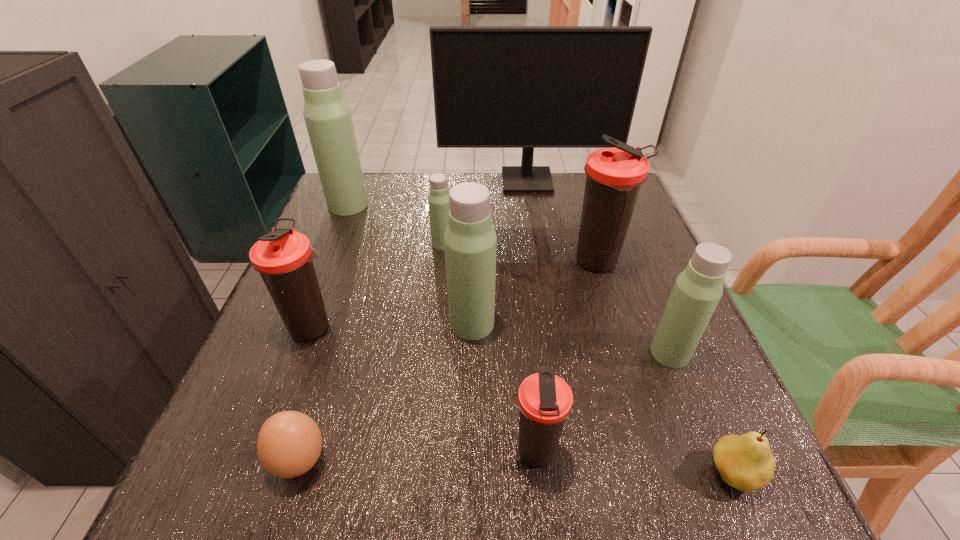
This screenshot has width=960, height=540. What are the coordinates of `boiled egg that is at the near edge` in the screenshot? It's located at (289, 443).

Where is `boiled egg that is at the left edge`? Image resolution: width=960 pixels, height=540 pixels. boiled egg that is at the left edge is located at coordinates (289, 443).

In order to click on computer monitor positioned at the right edge in this screenshot , I will do `click(527, 87)`.

This screenshot has width=960, height=540. What are the coordinates of `pear that is at the right edge` in the screenshot? It's located at (745, 462).

The width and height of the screenshot is (960, 540). In order to click on object that is positioned at the far left corner in this screenshot , I will do `click(327, 116)`.

Where is `object positioned at the near left corner`? object positioned at the near left corner is located at coordinates (289, 443).

You are a GUI agent. You are given a task and a screenshot of the screen. Output one action in this format:
    pyautogui.click(x=<x>, y=<y>)
    Task: Click on the object that is at the far right corner
    This screenshot has height=540, width=960.
    Given the screenshot: What is the action you would take?
    pyautogui.click(x=527, y=87)

The width and height of the screenshot is (960, 540). Find the location of `object present at the near right corner`. object present at the near right corner is located at coordinates (745, 462).

Where is `free location at the far edge of the desktop`? The width and height of the screenshot is (960, 540). free location at the far edge of the desktop is located at coordinates (428, 217).

At what (x,y) coordinates should I click in order to perform the action: click on free space at the near edge. Please return your answer as a coordinate pair (x, y). This screenshot has width=960, height=540. Looking at the image, I should click on (524, 464).